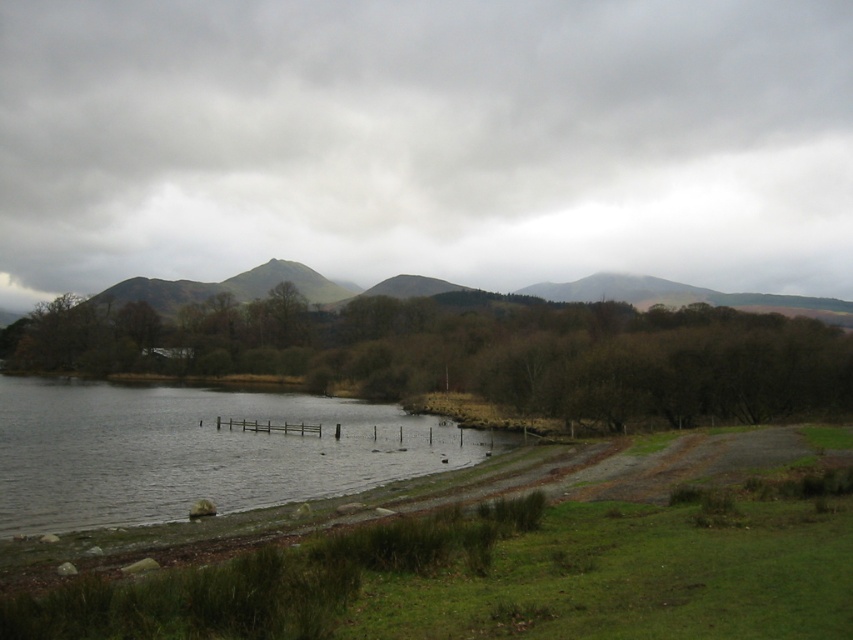
You are a hiker who wants to cross the grayish water at lower left to reach the green mossy hill at upper center. Considering the width of the water, do you think it is feasible to cross it in one step?

The grayish water at lower left has a lesser width compared to green mossy hill at upper center, so it is possible to cross the grayish water at lower left in one step since it is narrower than the hill.

Consider the image. You are a hiker who wants to take a photo of the grayish water at lower left and the green mossy hill at upper center. Which object should you focus on first if you want to capture both in a single frame without moving your camera?

You should focus on the grayish water at lower left first because it is positioned on the left side of the green mossy hill at upper center, so adjusting the camera frame to include both would require ensuring the leftmost object is within view.